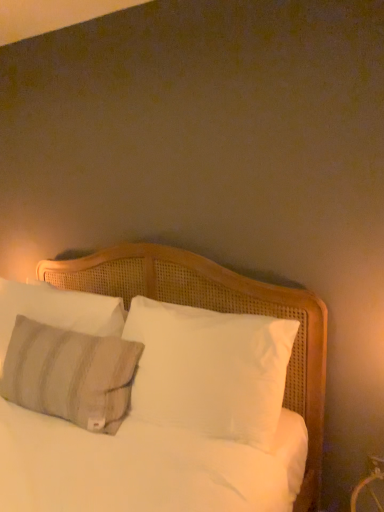
Question: From the image's perspective, relative to white woven bed at center, is textured gray pillow at left, marked as the second pillow in a back-to-front arrangement, above or below?

Choices:
 (A) below
 (B) above

Answer: (A)

Question: From their relative heights in the image, would you say textured gray pillow at left, marked as the second pillow in a back-to-front arrangement, is taller or shorter than white woven bed at center?

Choices:
 (A) short
 (B) tall

Answer: (A)

Question: Based on their relative distances, which object is nearer to the textured gray pillow at left, marked as the second pillow in a back-to-front arrangement?

Choices:
 (A) white woven bed at center
 (B) textured gray pillow at left, which is the 1th pillow from back to front

Answer: (B)

Question: Estimate the real-world distances between objects in this image. Which object is closer to the white woven bed at center?

Choices:
 (A) textured gray pillow at left, marked as the second pillow in a back-to-front arrangement
 (B) textured gray pillow at left, which is counted as the second pillow, starting from the front

Answer: (B)